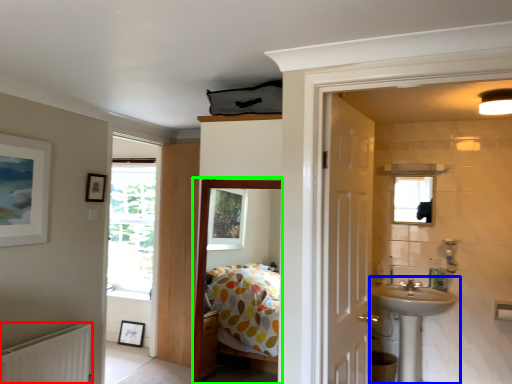
Question: Which is farther away from radiator (highlighted by a red box)? sink (highlighted by a blue box) or corridor (highlighted by a green box)?

Choices:
 (A) sink
 (B) corridor

Answer: (A)